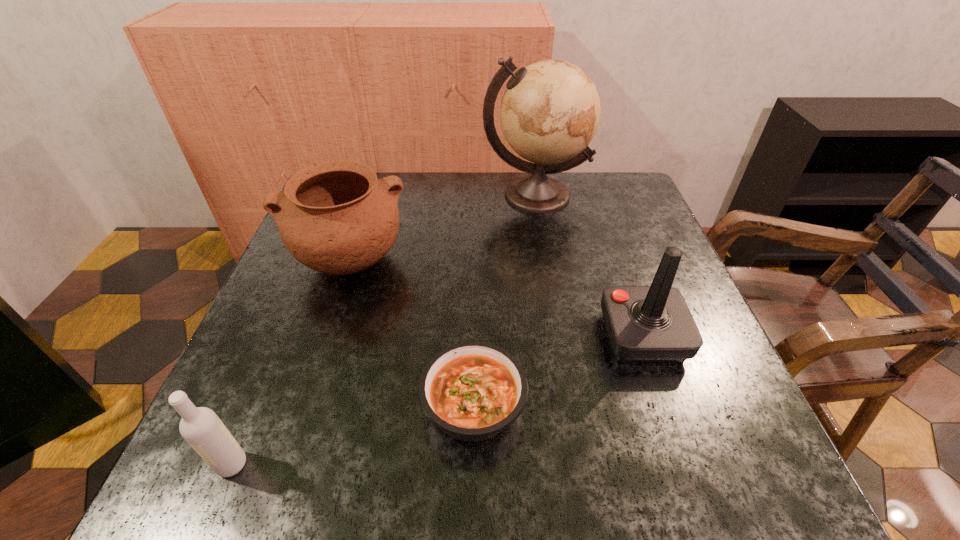
Locate an element on the screen. The height and width of the screenshot is (540, 960). the tallest object is located at coordinates pyautogui.click(x=550, y=111).

At what (x,y) coordinates should I click in order to perform the action: click on globe. Please return your answer as a coordinate pair (x, y). This screenshot has height=540, width=960. Looking at the image, I should click on (550, 111).

The height and width of the screenshot is (540, 960). Identify the location of joystick. (646, 324).

Locate an element on the screen. The height and width of the screenshot is (540, 960). the fourth nearest object is located at coordinates (335, 217).

Find the location of `vodka`. vodka is located at coordinates (201, 427).

At what (x,y) coordinates should I click in order to perform the action: click on the shortest object. Please return your answer as a coordinate pair (x, y). Image resolution: width=960 pixels, height=540 pixels. Looking at the image, I should click on (472, 390).

Find the location of a particular element. free space located on the front-facing side of the globe is located at coordinates (556, 321).

The image size is (960, 540). Identify the location of free space located 0.230m on the left of the joystick. (480, 336).

What are the coordinates of `free location located 0.250m on the front of the second farthest object` in the screenshot? It's located at (299, 410).

In order to click on free region located 0.400m on the right of the vodka in this screenshot , I will do `click(519, 464)`.